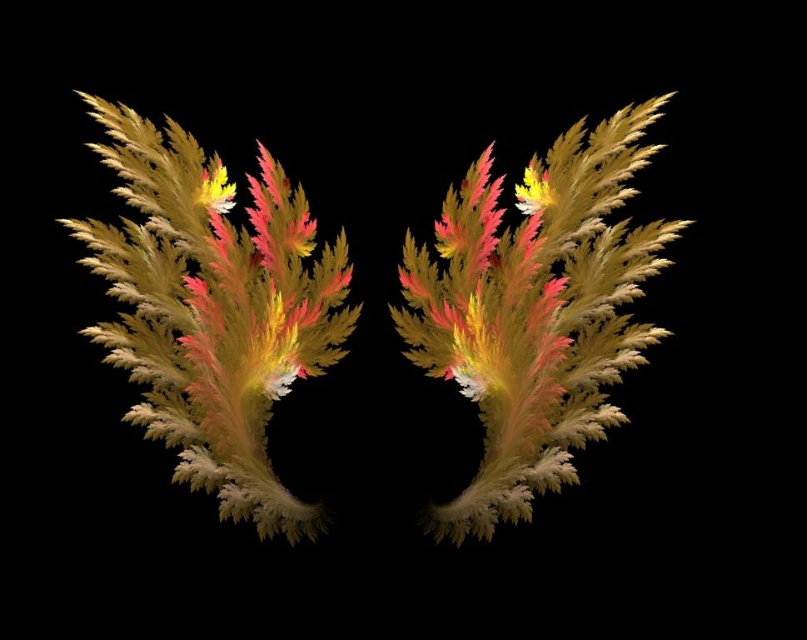
Question: Which object is the farthest from the velvety gold and pink flower at left?

Choices:
 (A) multicolored frond at center
 (B) shiny golden leaf at center

Answer: (A)

Question: Is shiny golden leaf at center thinner than multicolored frond at center?

Choices:
 (A) yes
 (B) no

Answer: (B)

Question: Which of the following is the closest to the observer?

Choices:
 (A) multicolored frond at center
 (B) shiny golden leaf at center
 (C) velvety gold and pink flower at left

Answer: (C)

Question: Can you confirm if multicolored frond at center is positioned to the right of velvety gold and pink flower at left?

Choices:
 (A) no
 (B) yes

Answer: (B)

Question: Does shiny golden leaf at center have a lesser width compared to multicolored frond at center?

Choices:
 (A) yes
 (B) no

Answer: (B)

Question: Among these points, which one is farthest from the camera?

Choices:
 (A) (124, 184)
 (B) (538, 241)
 (C) (337, 236)

Answer: (C)